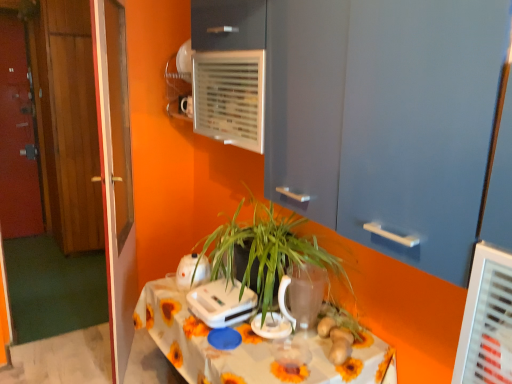
The width and height of the screenshot is (512, 384). What are the coordinates of `vacant area to the right of white glossy kettle at center, which is the 1th appliance in right-to-left order` in the screenshot? It's located at (320, 331).